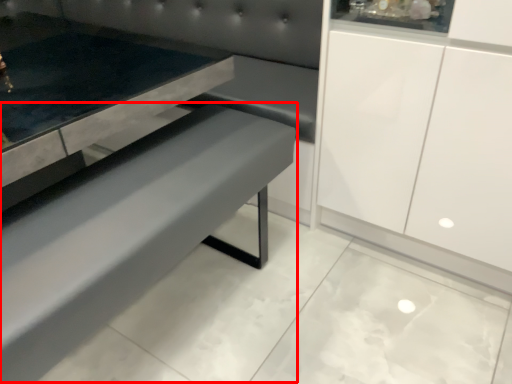
Question: From the image's perspective, considering the relative positions of park bench (annotated by the red box) and couch in the image provided, where is park bench (annotated by the red box) located with respect to the staircase?

Choices:
 (A) above
 (B) below

Answer: (B)